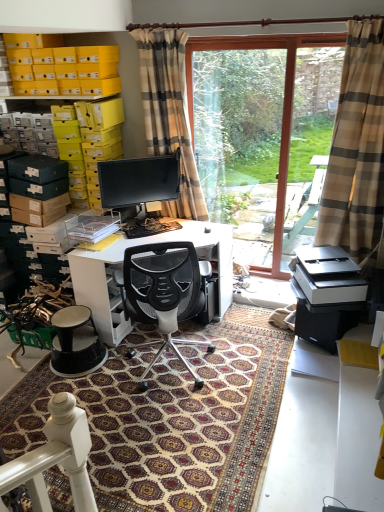
Question: Visually, is white matte printer at lower right positioned to the left or to the right of matte black monitor at center?

Choices:
 (A) left
 (B) right

Answer: (B)

Question: Relative to matte black monitor at center, is white matte printer at lower right in front or behind?

Choices:
 (A) front
 (B) behind

Answer: (A)

Question: Estimate the real-world distances between objects in this image. Which object is closer to the patterned carpet at center?

Choices:
 (A) transparent glass door at center
 (B) plaid fabric curtain at center, marked as the first curtain in a left-to-right arrangement
 (C) white glossy desk at center
 (D) white matte printer at lower right
 (E) yellow cardboard boxes at upper left

Answer: (C)

Question: Estimate the real-world distances between objects in this image. Which object is farther from the plaid fabric curtain at center, which is the 2th curtain from right to left?

Choices:
 (A) white glossy desk at center
 (B) transparent glass door at center
 (C) beige plaid curtain at right, marked as the 2th curtain in a left-to-right arrangement
 (D) black mesh office chair at center
 (E) white matte printer at lower right

Answer: (E)